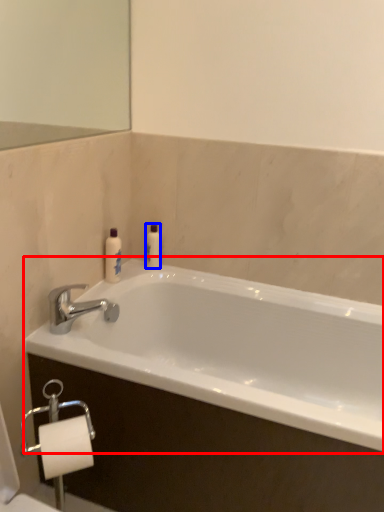
Question: Among these objects, which one is farthest to the camera, bathtub (highlighted by a red box) or toiletry (highlighted by a blue box)?

Choices:
 (A) bathtub
 (B) toiletry

Answer: (B)